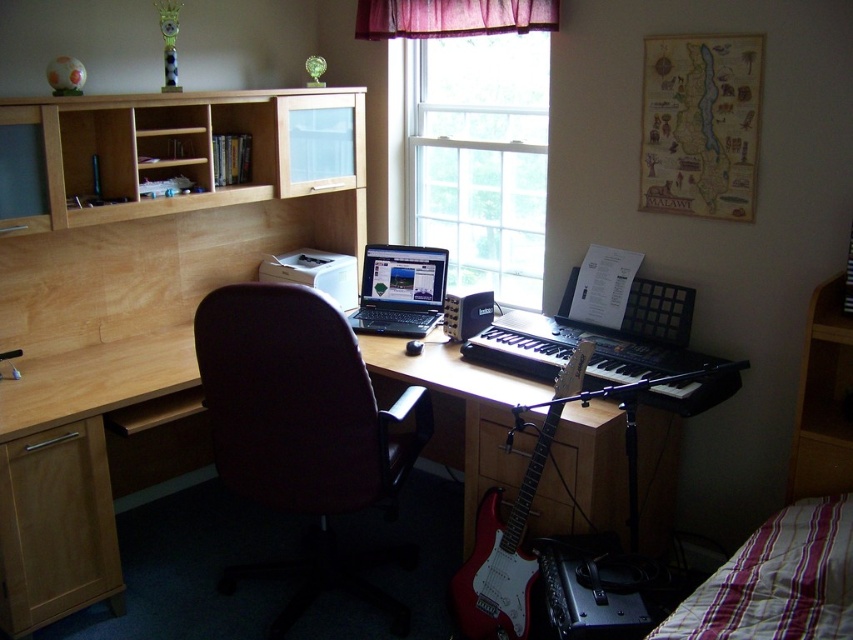
Question: Considering the relative positions of transparent glass window at center and striped fabric bed at lower right in the image provided, where is transparent glass window at center located with respect to striped fabric bed at lower right?

Choices:
 (A) below
 (B) above

Answer: (B)

Question: Is wooden computer desk at center further to camera compared to transparent glass window at center?

Choices:
 (A) no
 (B) yes

Answer: (A)

Question: Among these points, which one is farthest from the camera?

Choices:
 (A) (108, 499)
 (B) (498, 556)
 (C) (459, 129)
 (D) (325, 552)

Answer: (C)

Question: Which of these objects is positioned closest to the wooden computer desk at center?

Choices:
 (A) striped fabric bed at lower right
 (B) brown leather swivel chair at center
 (C) black matte keyboard at center

Answer: (C)

Question: Among these points, which one is nearest to the camera?

Choices:
 (A) (495, 189)
 (B) (566, 385)
 (C) (689, 598)
 (D) (624, 339)

Answer: (C)

Question: Does striped fabric bed at lower right have a lesser width compared to black matte keyboard at center?

Choices:
 (A) no
 (B) yes

Answer: (B)